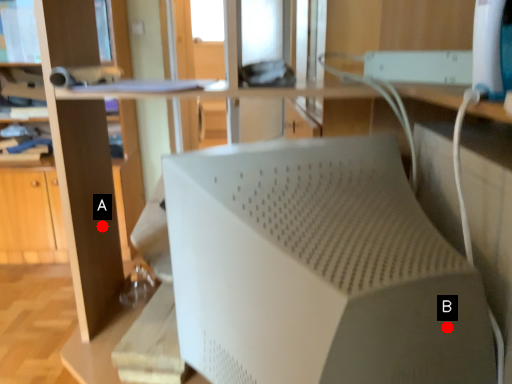
Question: Two points are circled on the image, labeled by A and B beside each circle. Among these points, which one is nearest to the camera?

Choices:
 (A) A is closer
 (B) B is closer

Answer: (B)